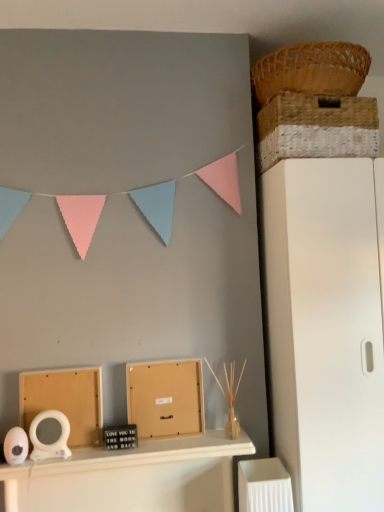
Question: Considering the relative sizes of white glossy mirror at center and woven brown basket at upper right, which ranks as the second basket in bottom-to-top order, in the image provided, is white glossy mirror at center wider than woven brown basket at upper right, which ranks as the second basket in bottom-to-top order,?

Choices:
 (A) yes
 (B) no

Answer: (A)

Question: From the image's perspective, is white glossy mirror at center beneath woven brown basket at upper right, which is the 1th basket from top to bottom?

Choices:
 (A) no
 (B) yes

Answer: (B)

Question: Does white glossy mirror at center turn towards woven brown basket at upper right, which ranks as the second basket in bottom-to-top order?

Choices:
 (A) no
 (B) yes

Answer: (A)

Question: From a real-world perspective, is white glossy mirror at center on top of woven brown basket at upper right, which is the 1th basket from top to bottom?

Choices:
 (A) no
 (B) yes

Answer: (A)

Question: Is white glossy mirror at center smaller than woven brown basket at upper right, which ranks as the second basket in bottom-to-top order?

Choices:
 (A) no
 (B) yes

Answer: (A)

Question: Considering the relative sizes of white glossy mirror at center and woven brown basket at upper right, which ranks as the second basket in bottom-to-top order, in the image provided, is white glossy mirror at center bigger than woven brown basket at upper right, which ranks as the second basket in bottom-to-top order,?

Choices:
 (A) no
 (B) yes

Answer: (B)

Question: Is matte cardboard box at lower left, arranged as the second cardboard box when viewed from the right, taller than matte cardboard box at center, acting as the first cardboard box starting from the right?

Choices:
 (A) no
 (B) yes

Answer: (B)

Question: Is the depth of matte cardboard box at lower left, which is the 1th cardboard box in left-to-right order, less than that of matte cardboard box at center, acting as the first cardboard box starting from the right?

Choices:
 (A) yes
 (B) no

Answer: (A)

Question: Is matte cardboard box at lower left, which is the 1th cardboard box in left-to-right order, bigger than matte cardboard box at center, acting as the first cardboard box starting from the right?

Choices:
 (A) yes
 (B) no

Answer: (A)

Question: Is matte cardboard box at lower left, which is the 1th cardboard box in left-to-right order, to the right of matte cardboard box at center, acting as the first cardboard box starting from the right, from the viewer's perspective?

Choices:
 (A) no
 (B) yes

Answer: (A)

Question: Does matte cardboard box at lower left, arranged as the second cardboard box when viewed from the right, have a smaller size compared to matte cardboard box at center, acting as the first cardboard box starting from the right?

Choices:
 (A) yes
 (B) no

Answer: (B)

Question: Considering the relative positions of matte cardboard box at lower left, arranged as the second cardboard box when viewed from the right, and matte cardboard box at center, acting as the second cardboard box starting from the left, in the image provided, is matte cardboard box at lower left, arranged as the second cardboard box when viewed from the right, behind matte cardboard box at center, acting as the second cardboard box starting from the left,?

Choices:
 (A) no
 (B) yes

Answer: (A)

Question: Is woven straw basket at upper right, the 1th basket ordered from the bottom, at the right side of white glossy mirror at center?

Choices:
 (A) no
 (B) yes

Answer: (B)